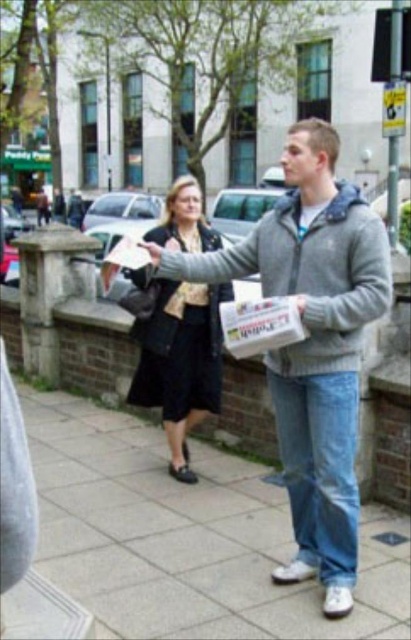
You are a photographer trying to capture a candid shot of the man and the woman in the scene. You notice two points marked in the image, point 1 at coordinates point (300,161) and point 2 at coordinates point (163,342). Which point is closer to the camera and should be focused on to ensure the man is in sharp focus?

Point (300,161) is closer to the camera than point (163,342). Therefore, focusing on point (300,161) would ensure the man is in sharp focus.

You are a photographer trying to capture both the gray fleece jacket at center and the matte black sweatshirt at center in the same frame. Based on their positions, which one should you focus on first to ensure both are in focus?

You should focus on the gray fleece jacket at center first because it is closer to the viewer than the matte black sweatshirt at center, so adjusting focus from near to far will help both be in focus.

You are a pedestrian on the sidewalk in the scene. You see the gray fleece jacket at center and the matte plastic bag at lower left. Which object is closer to the left edge of the sidewalk?

The matte plastic bag at lower left is closer to the left edge of the sidewalk because the gray fleece jacket at center is to the right of it.